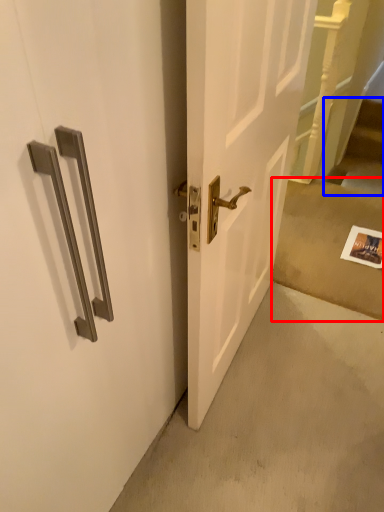
Question: Which point is closer to the camera, concrete (highlighted by a red box) or stairwell (highlighted by a blue box)?

Choices:
 (A) concrete
 (B) stairwell

Answer: (A)